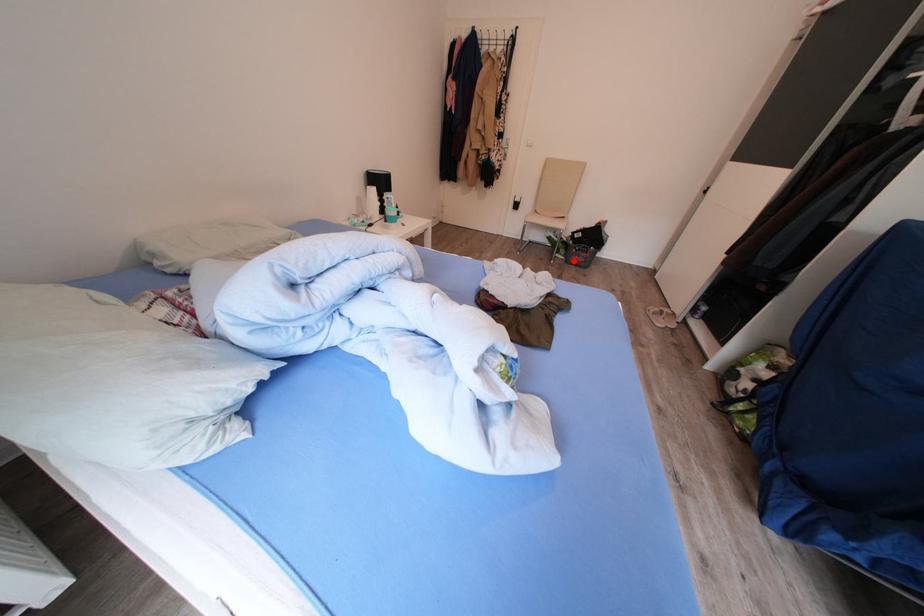
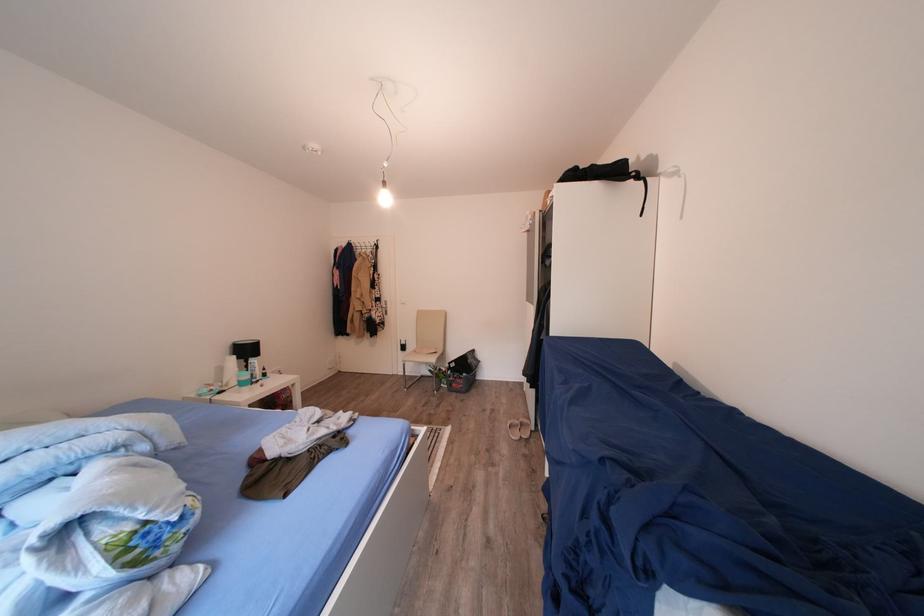
Question: I am providing you with two images of the same scene from different viewpoints. A red point is shown in image1. For the corresponding object point in image2, is it positioned nearer or farther from the camera?

Choices:
 (A) Nearer
 (B) Farther

Answer: (A)